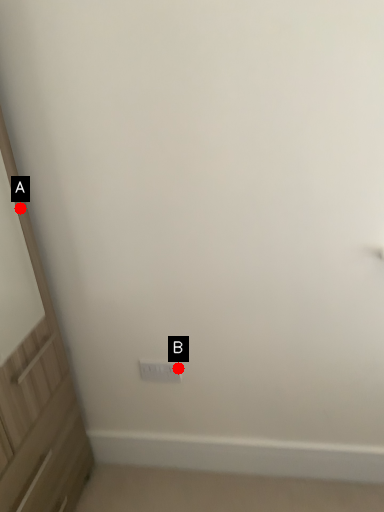
Question: Two points are circled on the image, labeled by A and B beside each circle. Which point appears farthest from the camera in this image?

Choices:
 (A) A is further
 (B) B is further

Answer: (B)